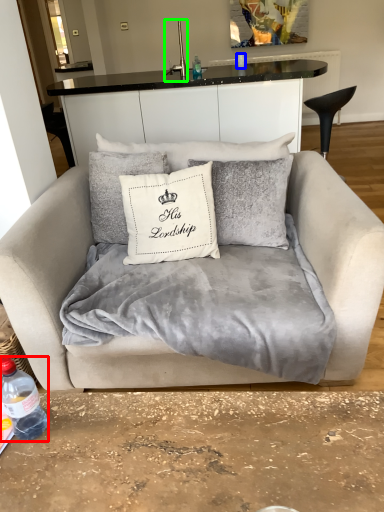
Question: Estimate the real-world distances between objects in this image. Which object is closer to bottle (highlighted by a red box), coffee cup (highlighted by a blue box) or faucet (highlighted by a green box)?

Choices:
 (A) coffee cup
 (B) faucet

Answer: (B)